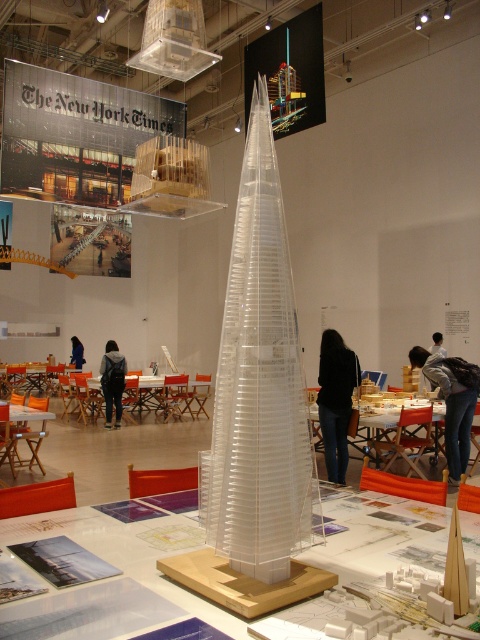
Question: Can you confirm if blue fabric jacket at center is positioned below black fabric at center?

Choices:
 (A) yes
 (B) no

Answer: (A)

Question: In this image, where is black leather jacket at center located relative to jeans at center?

Choices:
 (A) left
 (B) right

Answer: (A)

Question: Which object is closer to the camera taking this photo?

Choices:
 (A) blue fabric jacket at center
 (B) dark blue jacket at center
 (C) black fabric at center

Answer: (C)

Question: Which of the following is the farthest from the observer?

Choices:
 (A) black fabric at center
 (B) transparent plastic tower at center

Answer: (A)

Question: Does dark blue jacket at center appear on the left side of blue fabric jacket at center?

Choices:
 (A) yes
 (B) no

Answer: (B)

Question: Which object is the closest to the dark blue jacket at center?

Choices:
 (A) jeans at center
 (B) transparent plastic tower at center
 (C) black fabric at center
 (D) black leather jacket at center

Answer: (D)